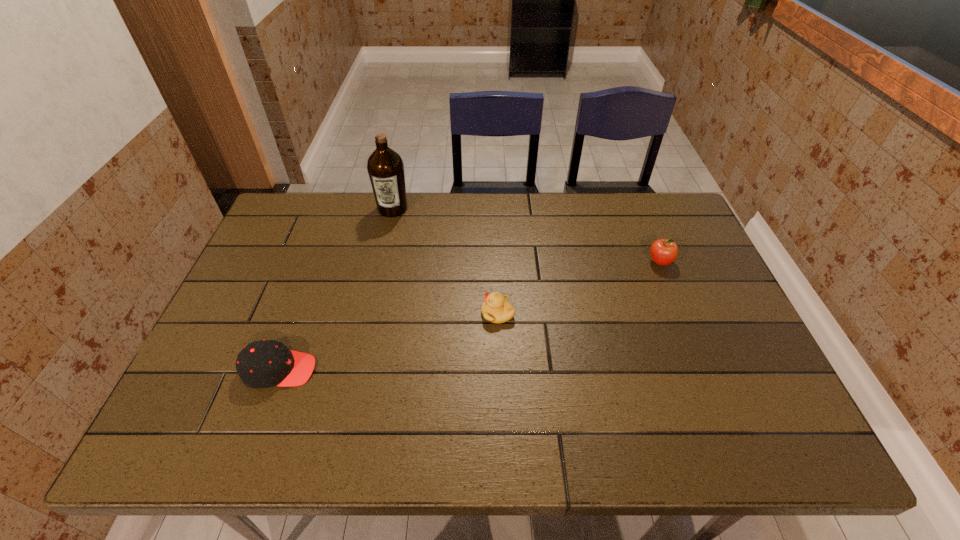
In the image, there is a desktop. Identify the location of vacant space at the right edge. (752, 350).

Where is `vacant area at the far left corner`? Image resolution: width=960 pixels, height=540 pixels. vacant area at the far left corner is located at coordinates (280, 213).

Locate an element on the screen. vacant area that lies between the second object from left to right and the apple is located at coordinates (526, 235).

Find the location of a particular element. The height and width of the screenshot is (540, 960). vacant area that lies between the second farthest object and the duckling is located at coordinates (579, 288).

Identify the location of free space between the farthest object and the apple. (526, 235).

In order to click on unoccupied position between the duckling and the tallest object in this screenshot , I will do 445,261.

The image size is (960, 540). Identify the location of free point between the leftmost object and the tallest object. (336, 289).

Locate an element on the screen. The image size is (960, 540). vacant region between the third object from right to left and the duckling is located at coordinates (445, 261).

What are the coordinates of `vacant area that lies between the cap and the second object from right to left` in the screenshot? It's located at (389, 342).

Identify the location of free space between the second object from left to right and the third object from left to right. (445, 261).